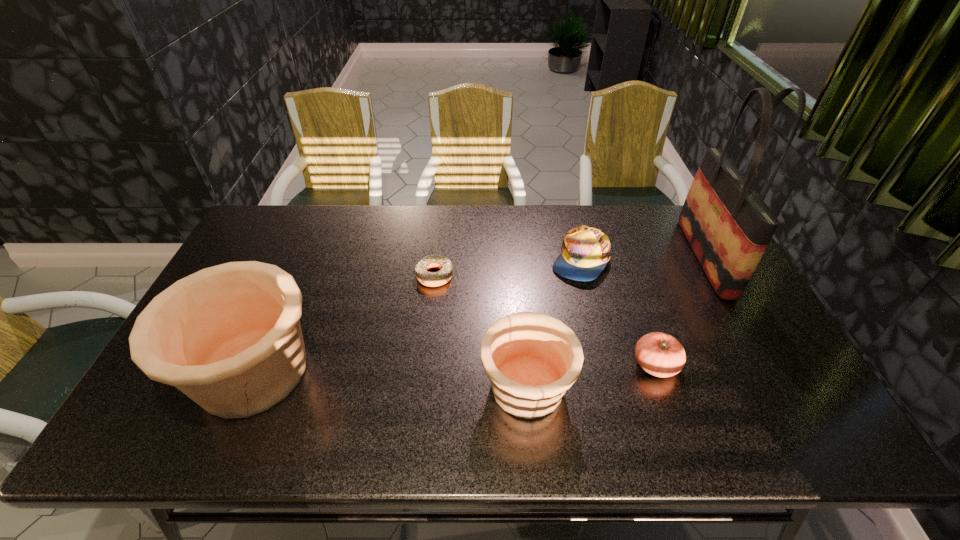
The image size is (960, 540). In order to click on the leftmost object in this screenshot , I will do `click(229, 337)`.

Locate an element on the screen. Image resolution: width=960 pixels, height=540 pixels. the second tallest object is located at coordinates (229, 337).

I want to click on the third tallest object, so click(531, 359).

Where is `the right pottery`? This screenshot has width=960, height=540. the right pottery is located at coordinates (531, 359).

What are the coordinates of `cap` in the screenshot? It's located at (585, 251).

This screenshot has height=540, width=960. What are the coordinates of `the tallest object` in the screenshot? It's located at (728, 225).

The height and width of the screenshot is (540, 960). I want to click on shopping bag, so click(728, 225).

This screenshot has height=540, width=960. What are the coordinates of `doughnut` in the screenshot? It's located at (431, 279).

The width and height of the screenshot is (960, 540). Identify the location of the shortest object. (431, 279).

Find the location of a particular element. The height and width of the screenshot is (540, 960). tomato is located at coordinates (659, 354).